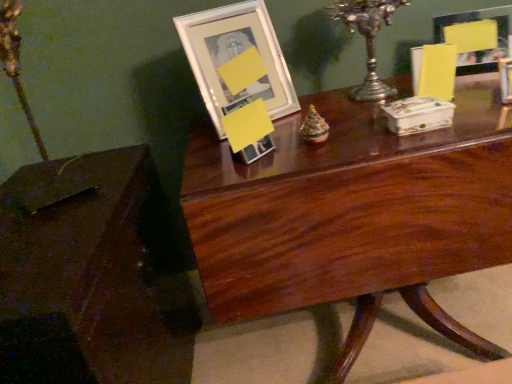
Locate an element on the screen. free space in front of matte glass picture frame at upper right, acting as the 1th picture frame starting from the right is located at coordinates (474, 81).